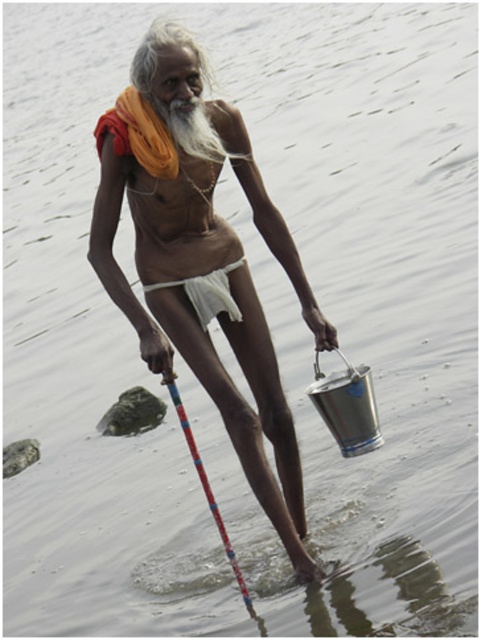
Question: Can you confirm if matte silver bucket at lower center is smaller than white cloth at center?

Choices:
 (A) no
 (B) yes

Answer: (A)

Question: Does matte silver bucket at lower center appear over white cloth at center?

Choices:
 (A) yes
 (B) no

Answer: (B)

Question: Which point is farther from the camera taking this photo?

Choices:
 (A) (304, 515)
 (B) (215, 296)
 (C) (227, 540)

Answer: (A)

Question: Can you confirm if white cloth at center is positioned below multicolored plastic fishing pole at center?

Choices:
 (A) no
 (B) yes

Answer: (A)

Question: Which is nearer to the multicolored plastic fishing pole at center?

Choices:
 (A) matte silver bucket at lower center
 (B) white cloth at center

Answer: (A)

Question: Which object is the closest to the white cloth at center?

Choices:
 (A) multicolored plastic fishing pole at center
 (B) matte silver bucket at lower center

Answer: (B)